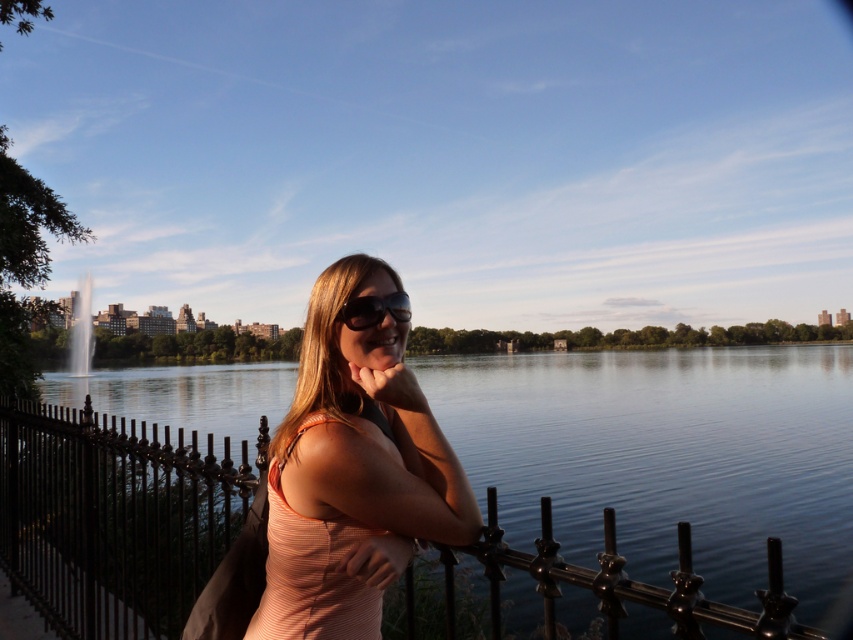
Which is behind, point (355, 296) or point (91, 292)?

The point (91, 292) is behind.

Measure the distance between shiny black sunglasses at center and shiny silver fountain at center.

shiny black sunglasses at center is 129.05 meters from shiny silver fountain at center.

I want to click on shiny black sunglasses at center, so click(374, 308).

In the scene shown: Is matte orange tank top at center to the left of shiny black sunglasses at center from the viewer's perspective?

Indeed, matte orange tank top at center is positioned on the left side of shiny black sunglasses at center.

Locate an element on the screen. The image size is (853, 640). matte orange tank top at center is located at coordinates (352, 470).

Can you confirm if black wrought iron fence at center is shorter than matte orange tank top at center?

No.

Is black wrought iron fence at center bigger than matte orange tank top at center?

Yes, black wrought iron fence at center is bigger than matte orange tank top at center.

Between point (260, 449) and point (369, 400), which one is positioned in front?

Point (369, 400) is in front.

This screenshot has width=853, height=640. I want to click on black wrought iron fence at center, so click(x=112, y=518).